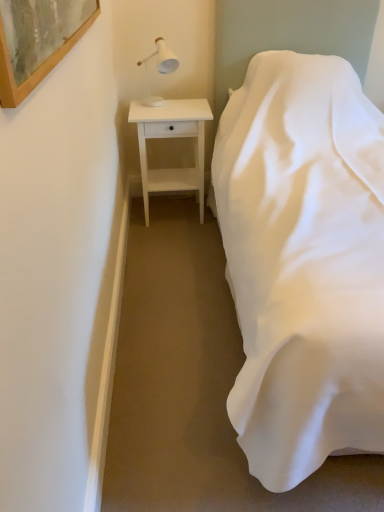
Question: From a real-world perspective, is white satin bed at right located beneath white wood nightstand at left?

Choices:
 (A) yes
 (B) no

Answer: (B)

Question: Can you confirm if white satin bed at right is wider than white wood nightstand at left?

Choices:
 (A) no
 (B) yes

Answer: (B)

Question: Considering the relative positions of white satin bed at right and white wood nightstand at left in the image provided, is white satin bed at right behind white wood nightstand at left?

Choices:
 (A) no
 (B) yes

Answer: (A)

Question: From the image's perspective, is white satin bed at right on top of white wood nightstand at left?

Choices:
 (A) no
 (B) yes

Answer: (A)

Question: From a real-world perspective, does white satin bed at right stand above white wood nightstand at left?

Choices:
 (A) no
 (B) yes

Answer: (B)

Question: In the image, is white satin bed at right positioned in front of or behind wooden-framed artwork at upper left?

Choices:
 (A) front
 (B) behind

Answer: (A)

Question: From a real-world perspective, is white satin bed at right physically located above or below wooden-framed artwork at upper left?

Choices:
 (A) above
 (B) below

Answer: (B)

Question: From their relative heights in the image, would you say white satin bed at right is taller or shorter than wooden-framed artwork at upper left?

Choices:
 (A) tall
 (B) short

Answer: (A)

Question: Considering the relative positions of white satin bed at right and wooden-framed artwork at upper left in the image provided, is white satin bed at right to the left or to the right of wooden-framed artwork at upper left?

Choices:
 (A) right
 (B) left

Answer: (A)

Question: From a real-world perspective, is white matte table lamp at upper left physically located above or below wooden-framed artwork at upper left?

Choices:
 (A) below
 (B) above

Answer: (A)

Question: Is white matte table lamp at upper left bigger or smaller than wooden-framed artwork at upper left?

Choices:
 (A) small
 (B) big

Answer: (B)

Question: From the image's perspective, is white matte table lamp at upper left positioned above or below wooden-framed artwork at upper left?

Choices:
 (A) below
 (B) above

Answer: (B)

Question: Does point (160, 53) appear closer or farther from the camera than point (79, 20)?

Choices:
 (A) closer
 (B) farther

Answer: (B)

Question: From the image's perspective, relative to white wood nightstand at left, is white matte table lamp at upper left above or below?

Choices:
 (A) above
 (B) below

Answer: (A)

Question: From a real-world perspective, is white matte table lamp at upper left above or below white wood nightstand at left?

Choices:
 (A) above
 (B) below

Answer: (A)